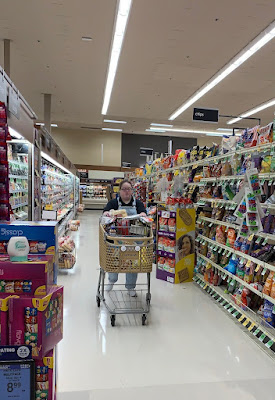
Image resolution: width=275 pixels, height=400 pixels. Find the location of `display box`. display box is located at coordinates (178, 231).